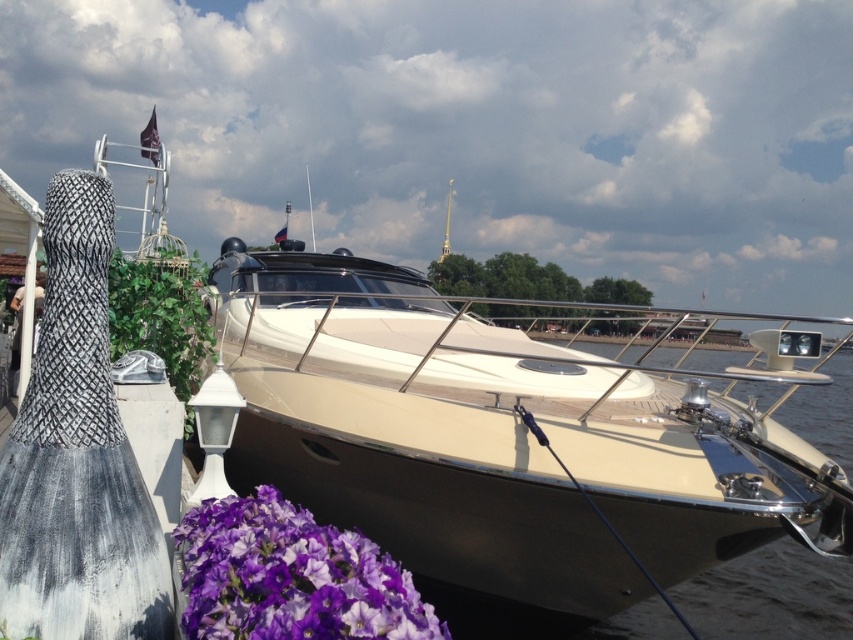
You are standing on the waterfront and see the point marked as point [289,577]. What object is located at this point?

The point [289,577] corresponds to the purple matte flower at lower left.